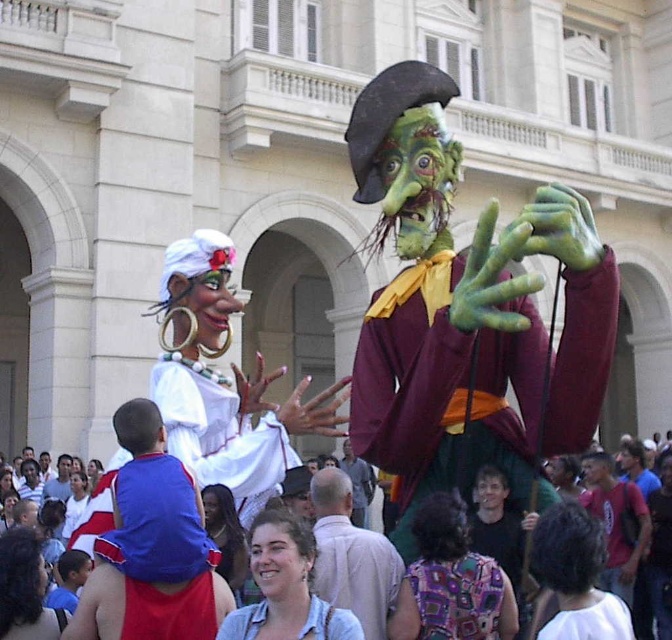
Question: Can you confirm if white satin dress at center is thinner than light blue t-shirt at center?

Choices:
 (A) yes
 (B) no

Answer: (B)

Question: Is green matte/maroon fabric at center closer to camera compared to light blue t-shirt at center?

Choices:
 (A) yes
 (B) no

Answer: (A)

Question: Based on their relative distances, which object is nearer to the smooth gray shirt at center?

Choices:
 (A) matte white shirt at center
 (B) white satin dress at center
 (C) light blue t-shirt at center

Answer: (A)

Question: Among these objects, which one is farthest from the camera?

Choices:
 (A) green matte/maroon fabric at center
 (B) white satin dress at center
 (C) light blue t-shirt at center

Answer: (C)

Question: Can you confirm if green matte/maroon fabric at center is positioned below blue fabric shirt at center?

Choices:
 (A) yes
 (B) no

Answer: (B)

Question: Which of the following is the farthest from the observer?

Choices:
 (A) light brown fabric shirt at center
 (B) knitted fabric blouse at center
 (C) white satin dress at center
 (D) matte white shirt at center

Answer: (C)